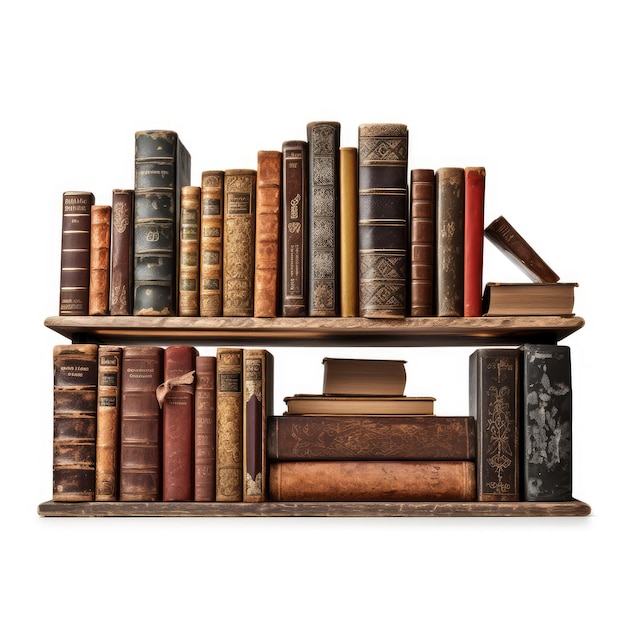
This screenshot has width=626, height=626. What are the coordinates of `thick book` in the screenshot? It's located at (74, 419), (145, 421), (396, 438), (418, 484), (545, 422), (490, 432), (382, 239), (151, 245), (503, 300), (355, 367).